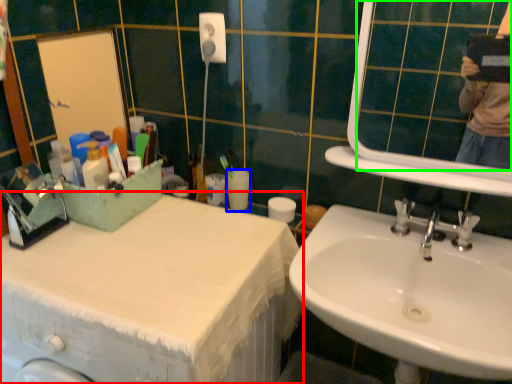
Question: Which object is positioned closest to counter top (highlighted by a red box)? Select from toilet paper (highlighted by a blue box) and mirror (highlighted by a green box).

Choices:
 (A) toilet paper
 (B) mirror

Answer: (A)